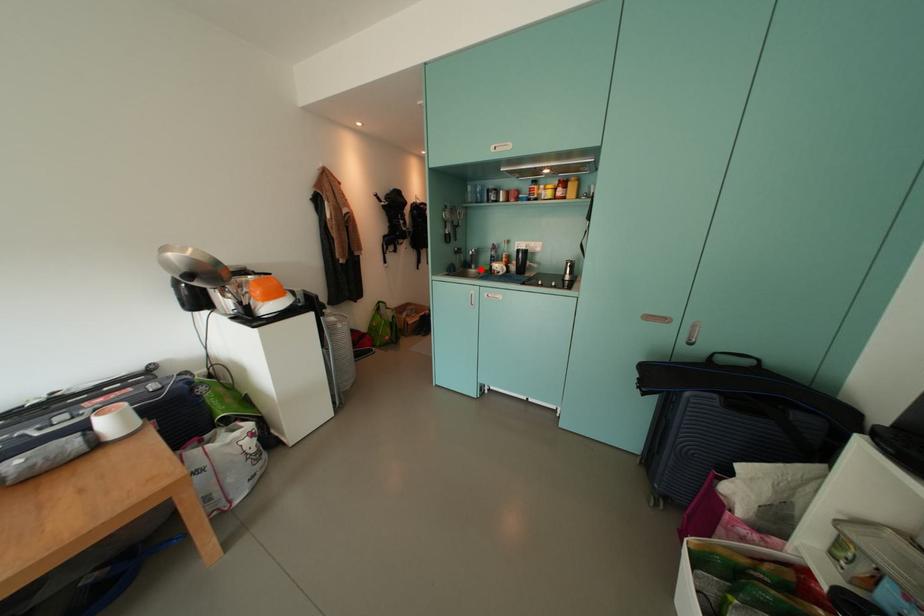
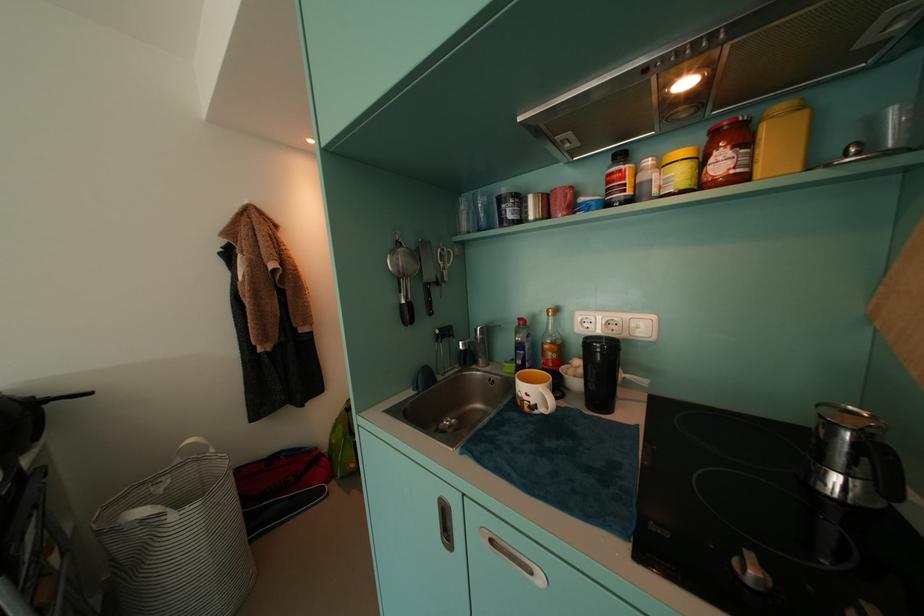
Question: I am providing you with two images of the same scene from different viewpoints. Given a red point in image1, look at the same physical point in image2. Is it:

Choices:
 (A) Closer to the viewpoint
 (B) Farther from the viewpoint

Answer: (B)